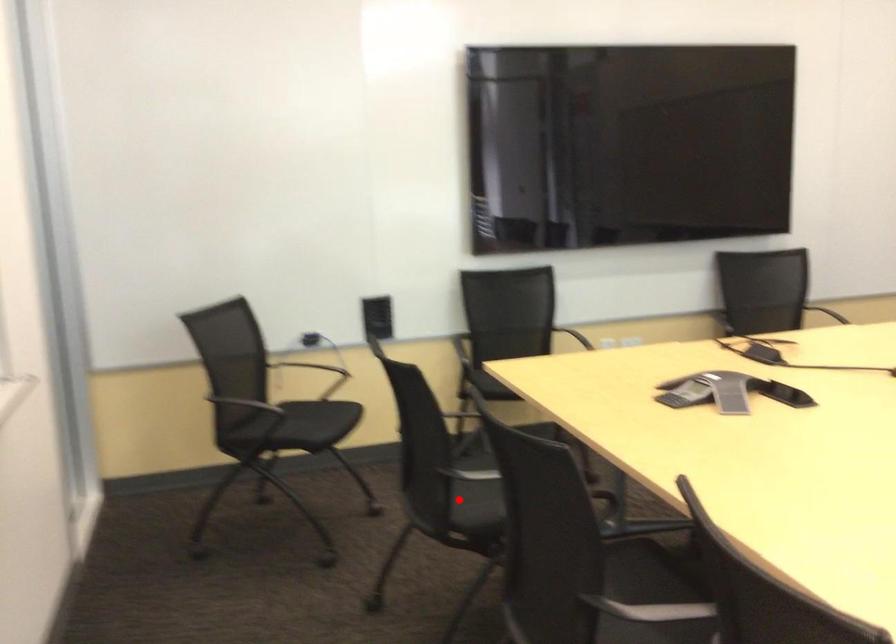
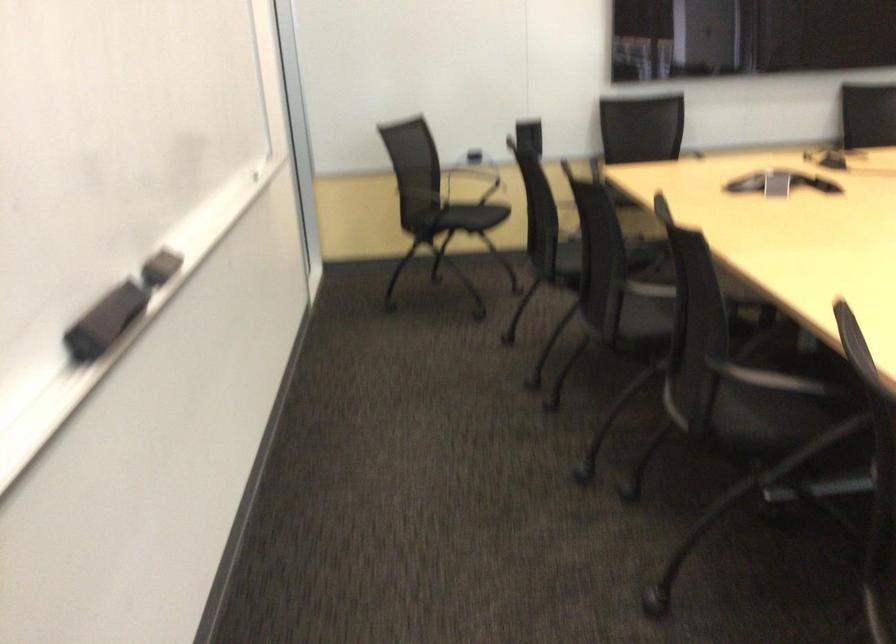
Find the pixel in the second image that matches the highlighted location in the first image.

(574, 258)